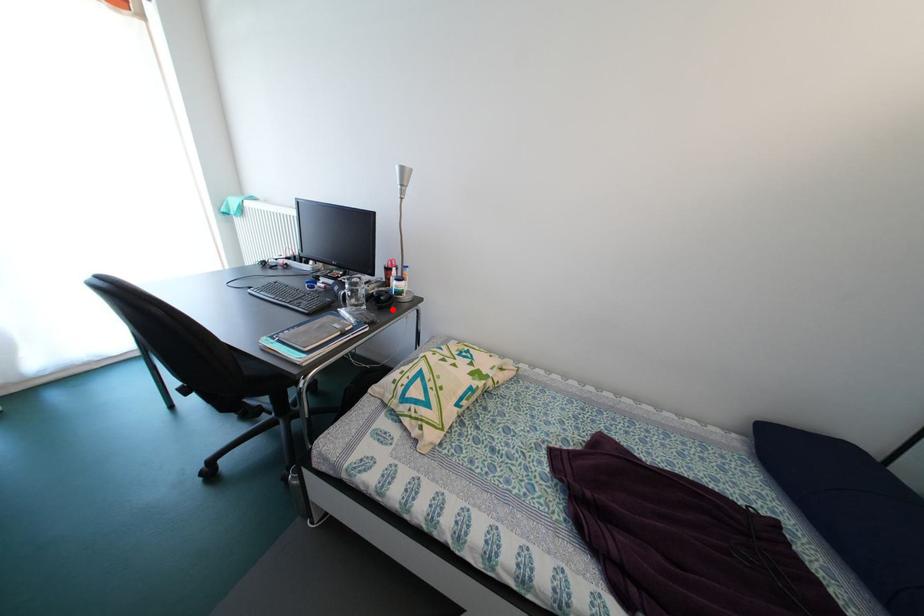
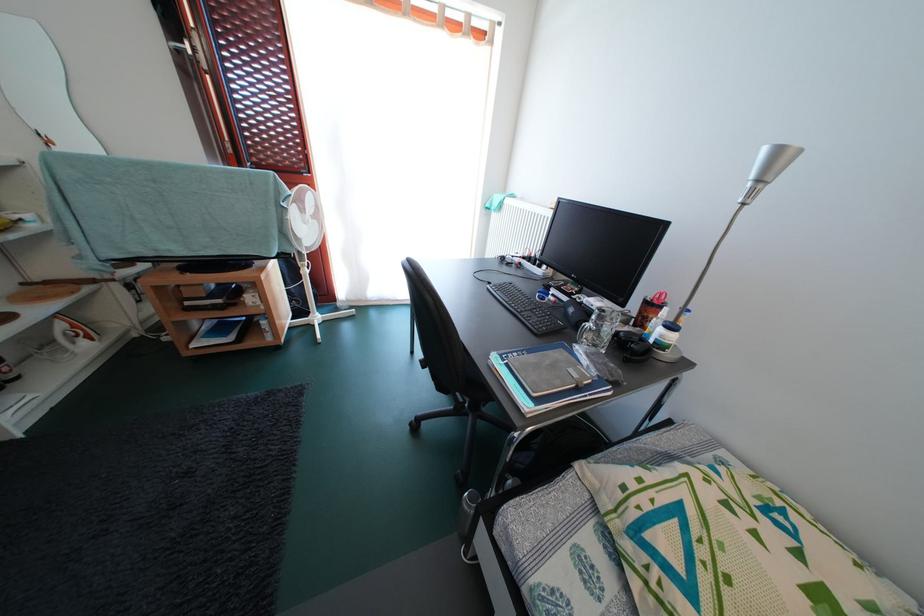
The point at the highlighted location is marked in the first image. Where is the corresponding point in the second image?

(640, 360)